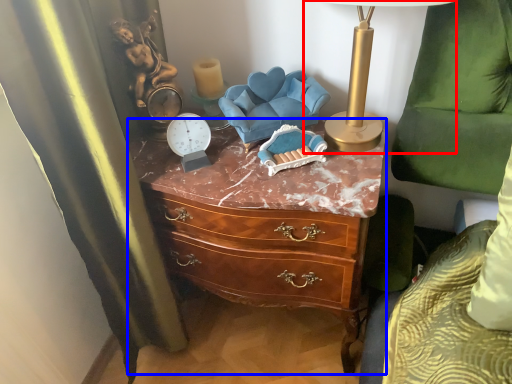
Question: Which object appears closest to the camera in this image, table lamp (highlighted by a red box) or chest of drawers (highlighted by a blue box)?

Choices:
 (A) table lamp
 (B) chest of drawers

Answer: (A)